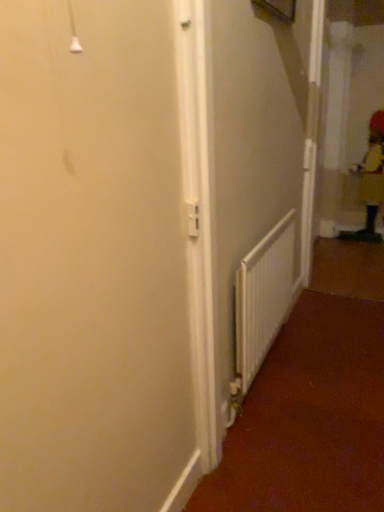
What do you see at coordinates (370, 181) in the screenshot?
I see `yellow fabric worker at right` at bounding box center [370, 181].

Measure the distance between point (378,112) and camera.

Point (378,112) and camera are 10.88 feet apart.

You are a GUI agent. You are given a task and a screenshot of the screen. Output one action in this format:
    pyautogui.click(x=<x>, y=<y>)
    Task: Click on the yellow fabric worker at right
    This screenshot has height=512, width=384.
    Given the screenshot: What is the action you would take?
    pyautogui.click(x=370, y=181)

This screenshot has height=512, width=384. In order to click on white matte radiator at center in this screenshot , I will do click(x=263, y=297).

The width and height of the screenshot is (384, 512). Describe the element at coordinates (263, 297) in the screenshot. I see `white matte radiator at center` at that location.

You are a GUI agent. You are given a task and a screenshot of the screen. Output one action in this format:
    pyautogui.click(x=<x>, y=<y>)
    Task: Click on the yellow fabric worker at right
    The height and width of the screenshot is (512, 384).
    Given the screenshot: What is the action you would take?
    pyautogui.click(x=370, y=181)

Considering the relative positions of white matte radiator at center and yellow fabric worker at right in the image provided, is white matte radiator at center to the left of yellow fabric worker at right from the viewer's perspective?

Yes, white matte radiator at center is to the left of yellow fabric worker at right.

Who is more distant, white matte radiator at center or yellow fabric worker at right?

yellow fabric worker at right is further from the camera.

Which is closer to the camera, (241,378) or (372,198)?

Positioned in front is point (241,378).

Consider the image. From the image's perspective, is white matte radiator at center beneath yellow fabric worker at right?

Correct, white matte radiator at center appears lower than yellow fabric worker at right in the image.

From a real-world perspective, is white matte radiator at center positioned under yellow fabric worker at right based on gravity?

Yes.

Is white matte radiator at center thinner than yellow fabric worker at right?

Correct, the width of white matte radiator at center is less than that of yellow fabric worker at right.

From the picture: Considering the relative sizes of white matte radiator at center and yellow fabric worker at right in the image provided, is white matte radiator at center taller than yellow fabric worker at right?

No.

Considering the relative sizes of white matte radiator at center and yellow fabric worker at right in the image provided, is white matte radiator at center bigger than yellow fabric worker at right?

No, white matte radiator at center is not bigger than yellow fabric worker at right.

Would you say white matte radiator at center is outside yellow fabric worker at right?

Indeed, white matte radiator at center is completely outside yellow fabric worker at right.

Is white matte radiator at center not close to yellow fabric worker at right?

Absolutely, white matte radiator at center is distant from yellow fabric worker at right.

Based on the photo, is white matte radiator at center aimed at yellow fabric worker at right?

No.

What's the angular difference between white matte radiator at center and yellow fabric worker at right's facing directions?

The angular difference between white matte radiator at center and yellow fabric worker at right is 90.3 degrees.

How far apart are white matte radiator at center and yellow fabric worker at right?

1.83 meters.

Identify the location of worker above the white matte radiator at center (from the image's perspective). This screenshot has width=384, height=512. (370, 181).

Which object is positioned more to the left, yellow fabric worker at right or white matte radiator at center?

Positioned to the left is white matte radiator at center.

From the picture: Is yellow fabric worker at right behind white matte radiator at center?

Yes, it is.

Which is behind, point (367, 239) or point (287, 261)?

Positioned behind is point (367, 239).

From the image's perspective, which one is positioned higher, yellow fabric worker at right or white matte radiator at center?

yellow fabric worker at right appears higher in the image.

From a real-world perspective, is yellow fabric worker at right under white matte radiator at center?

Actually, yellow fabric worker at right is physically above white matte radiator at center in the real world.

Considering the relative sizes of yellow fabric worker at right and white matte radiator at center in the image provided, is yellow fabric worker at right thinner than white matte radiator at center?

Incorrect, the width of yellow fabric worker at right is not less than that of white matte radiator at center.

Considering the relative sizes of yellow fabric worker at right and white matte radiator at center in the image provided, is yellow fabric worker at right taller than white matte radiator at center?

Yes.

Does yellow fabric worker at right have a smaller size compared to white matte radiator at center?

Actually, yellow fabric worker at right might be larger than white matte radiator at center.

Is yellow fabric worker at right inside the boundaries of white matte radiator at center, or outside?

yellow fabric worker at right is located beyond the bounds of white matte radiator at center.

Is yellow fabric worker at right next to white matte radiator at center and touching it?

No, yellow fabric worker at right is not in contact with white matte radiator at center.

Consider the image. Is yellow fabric worker at right facing away from white matte radiator at center?

No.

Image resolution: width=384 pixels, height=512 pixels. What are the coordinates of `worker positioned vertically above the white matte radiator at center (from a real-world perspective)` in the screenshot? It's located at (370, 181).

Identify the location of worker behind the white matte radiator at center. The image size is (384, 512). (370, 181).

This screenshot has height=512, width=384. Find the location of `radiator that appears below the yellow fabric worker at right (from a real-world perspective)`. radiator that appears below the yellow fabric worker at right (from a real-world perspective) is located at coordinates (263, 297).